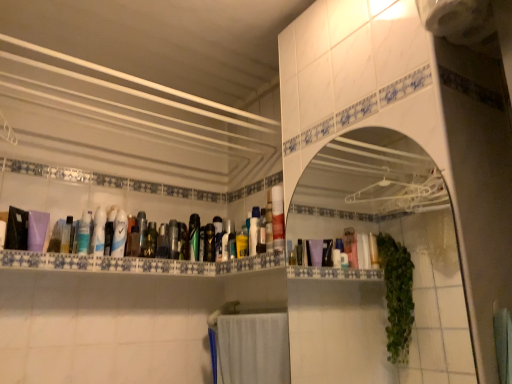
Question: Is white glossy mirror at center at the left side of matte plastic tube at center, the tenth mouthwash viewed from the left?

Choices:
 (A) yes
 (B) no

Answer: (B)

Question: Considering the relative positions of white glossy mirror at center and matte plastic tube at center, the tenth mouthwash viewed from the left, in the image provided, is white glossy mirror at center to the right of matte plastic tube at center, the tenth mouthwash viewed from the left, from the viewer's perspective?

Choices:
 (A) no
 (B) yes

Answer: (B)

Question: Is white glossy mirror at center outside matte plastic tube at center, the tenth mouthwash viewed from the left?

Choices:
 (A) no
 (B) yes

Answer: (B)

Question: Is white glossy mirror at center placed right next to matte plastic tube at center, the first mouthwash in the right-to-left sequence?

Choices:
 (A) no
 (B) yes

Answer: (A)

Question: From a real-world perspective, is white glossy mirror at center below matte plastic tube at center, the first mouthwash in the right-to-left sequence?

Choices:
 (A) yes
 (B) no

Answer: (A)

Question: Does white glossy mirror at center have a larger size compared to matte plastic tube at center, the tenth mouthwash viewed from the left?

Choices:
 (A) no
 (B) yes

Answer: (B)

Question: Considering the relative sizes of matte black bottle at center, acting as the 5th mouthwash starting from the right, and matte black bottle at center, the fourth toiletry in the left-to-right sequence, in the image provided, is matte black bottle at center, acting as the 5th mouthwash starting from the right, wider than matte black bottle at center, the fourth toiletry in the left-to-right sequence,?

Choices:
 (A) yes
 (B) no

Answer: (A)

Question: Is matte black bottle at center, acting as the 5th mouthwash starting from the right, with matte black bottle at center, which is the second toiletry in right-to-left order?

Choices:
 (A) no
 (B) yes

Answer: (B)

Question: From the image's perspective, is matte black bottle at center, acting as the 6th mouthwash starting from the left, over matte black bottle at center, the fourth toiletry in the left-to-right sequence?

Choices:
 (A) yes
 (B) no

Answer: (A)

Question: Considering the relative sizes of matte black bottle at center, acting as the 5th mouthwash starting from the right, and matte black bottle at center, the fourth toiletry in the left-to-right sequence, in the image provided, is matte black bottle at center, acting as the 5th mouthwash starting from the right, thinner than matte black bottle at center, the fourth toiletry in the left-to-right sequence,?

Choices:
 (A) no
 (B) yes

Answer: (A)

Question: Is the depth of matte black bottle at center, acting as the 5th mouthwash starting from the right, less than that of matte black bottle at center, which is the second toiletry in right-to-left order?

Choices:
 (A) yes
 (B) no

Answer: (A)

Question: Is matte black bottle at center, acting as the 5th mouthwash starting from the right, bigger than matte black bottle at center, the fourth toiletry in the left-to-right sequence?

Choices:
 (A) no
 (B) yes

Answer: (B)

Question: Are matte black bottle at center, which is the second toiletry in right-to-left order, and matte plastic mouthwash at center, the 3th mouthwash from the right, far apart?

Choices:
 (A) yes
 (B) no

Answer: (B)